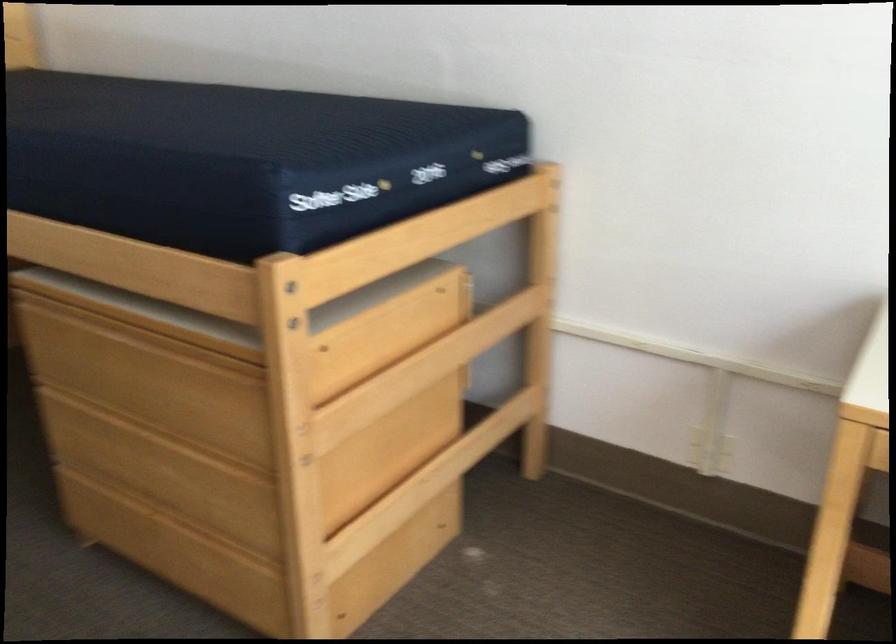
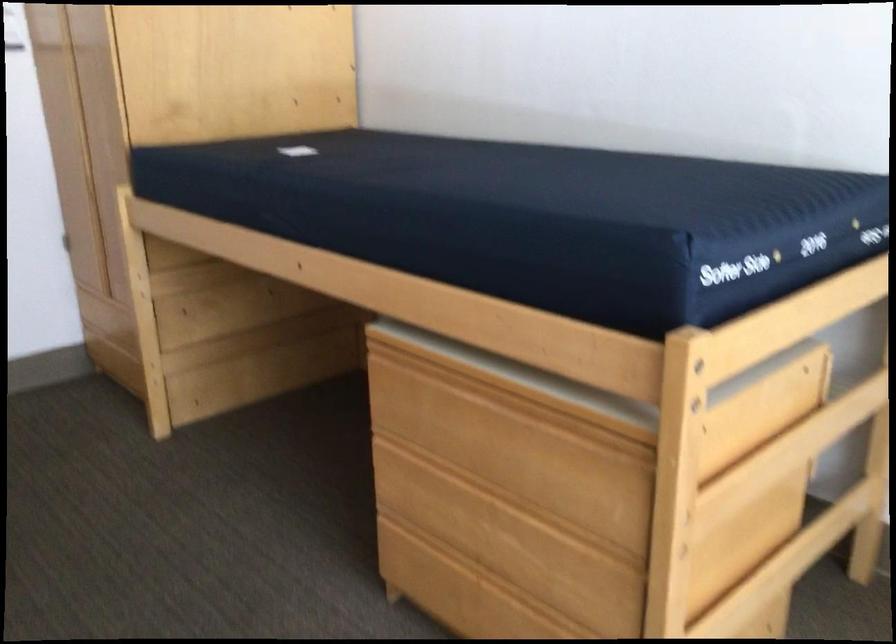
The point at (x=403, y=243) is marked in the first image. Where is the corresponding point in the second image?

(789, 319)